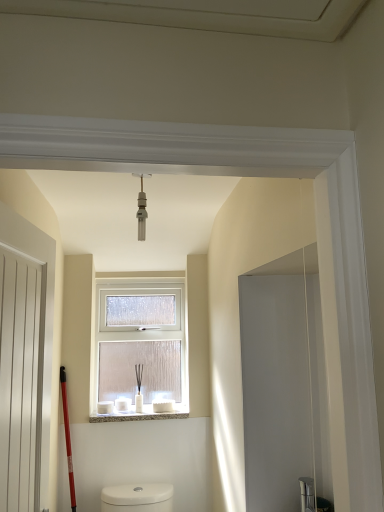
Where is `free space above clear frosted glass window at center (from a real-world perspective)`? The height and width of the screenshot is (512, 384). free space above clear frosted glass window at center (from a real-world perspective) is located at coordinates (134, 277).